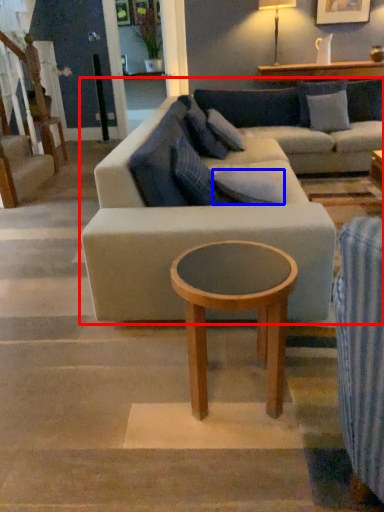
Question: Which object is further to the camera taking this photo, studio couch (highlighted by a red box) or pillow (highlighted by a blue box)?

Choices:
 (A) studio couch
 (B) pillow

Answer: (B)